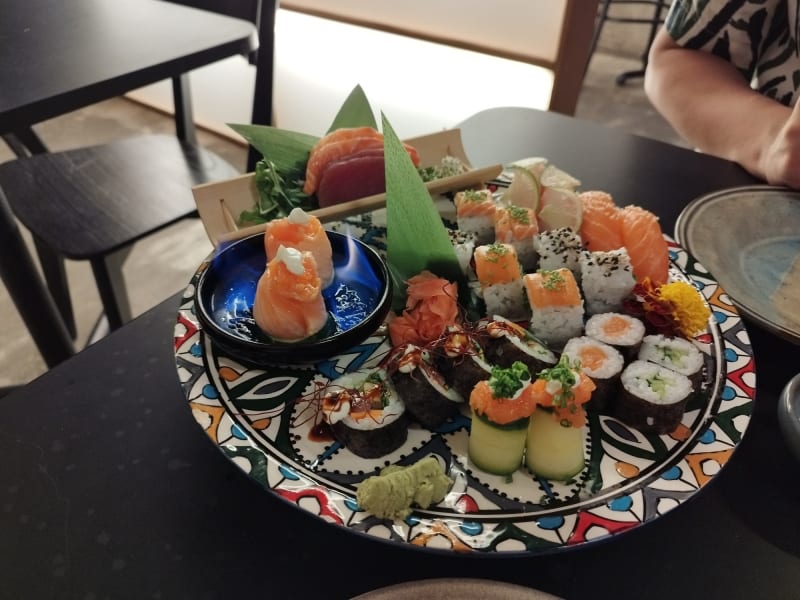
Identify the location of table. This screenshot has width=800, height=600. (96, 64), (172, 426).